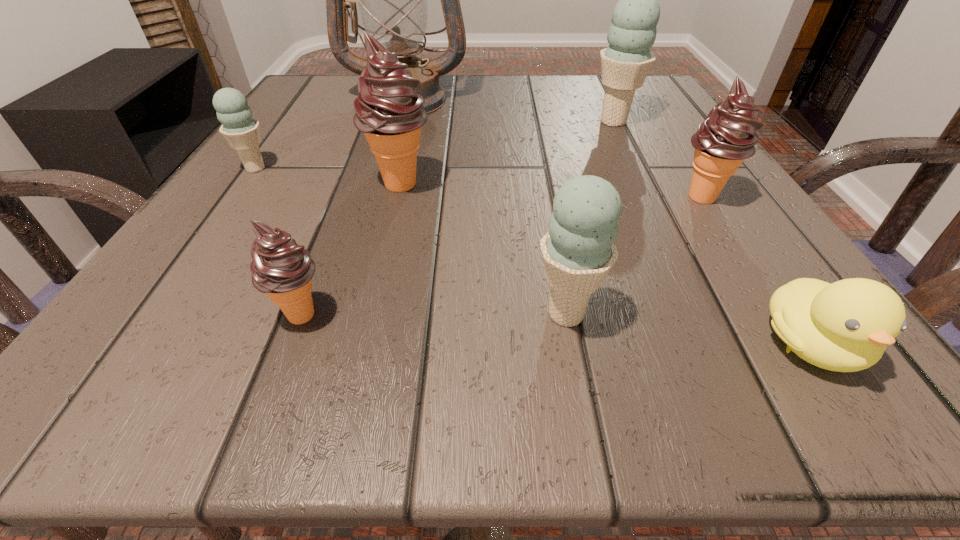
Locate an element on the screen. The height and width of the screenshot is (540, 960). brown oil lamp is located at coordinates (392, 0).

Image resolution: width=960 pixels, height=540 pixels. Find the location of `oil lamp`. oil lamp is located at coordinates (392, 0).

The height and width of the screenshot is (540, 960). Find the location of `the biggest blue ice cream`. the biggest blue ice cream is located at coordinates (625, 63).

Image resolution: width=960 pixels, height=540 pixels. Identify the location of the farthest blue ice cream. (625, 63).

This screenshot has width=960, height=540. What are the coordinates of `the biggest chocolate icecream` in the screenshot? It's located at pos(390,113).

This screenshot has width=960, height=540. I want to click on the second smallest chocolate icecream, so click(727, 137).

The height and width of the screenshot is (540, 960). Identify the location of the fourth object from right to left. (578, 251).

Image resolution: width=960 pixels, height=540 pixels. What are the coordinates of `the nearest blue ice cream` in the screenshot? It's located at (578, 251).

Locate an element on the screen. Image resolution: width=960 pixels, height=540 pixels. the leftmost blue ice cream is located at coordinates (242, 132).

Image resolution: width=960 pixels, height=540 pixels. In order to click on the leftmost object in this screenshot , I will do `click(242, 132)`.